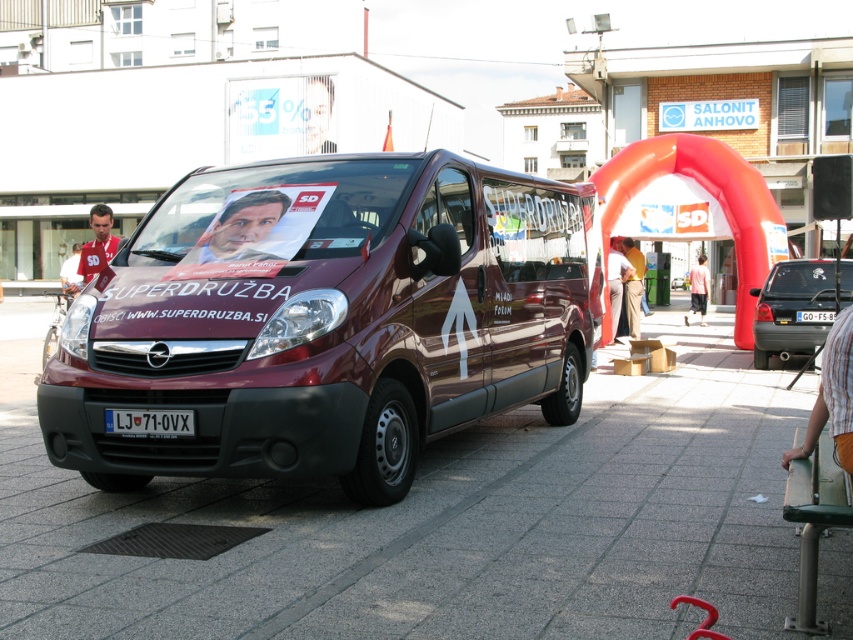
Question: Which point appears closest to the camera in this image?

Choices:
 (A) (364, 531)
 (B) (404, 204)

Answer: (A)

Question: Estimate the real-world distances between objects in this image. Which object is closer to the light brown fabric pants at center?

Choices:
 (A) khaki pants at center
 (B) smooth plastic poster at center
 (C) matte black van at center

Answer: (A)

Question: Which point is closer to the camera taking this photo?

Choices:
 (A) (627, 260)
 (B) (90, 214)
 (C) (241, 220)
 (D) (808, 288)

Answer: (C)

Question: Where is light brown fabric pants at center located in relation to matte red shirt at center in the image?

Choices:
 (A) left
 (B) right

Answer: (B)

Question: Does maroon metallic van at center come behind matte red shirt at center?

Choices:
 (A) yes
 (B) no

Answer: (B)

Question: Does marble pavement at center appear on the left side of matte red shirt at center?

Choices:
 (A) no
 (B) yes

Answer: (A)